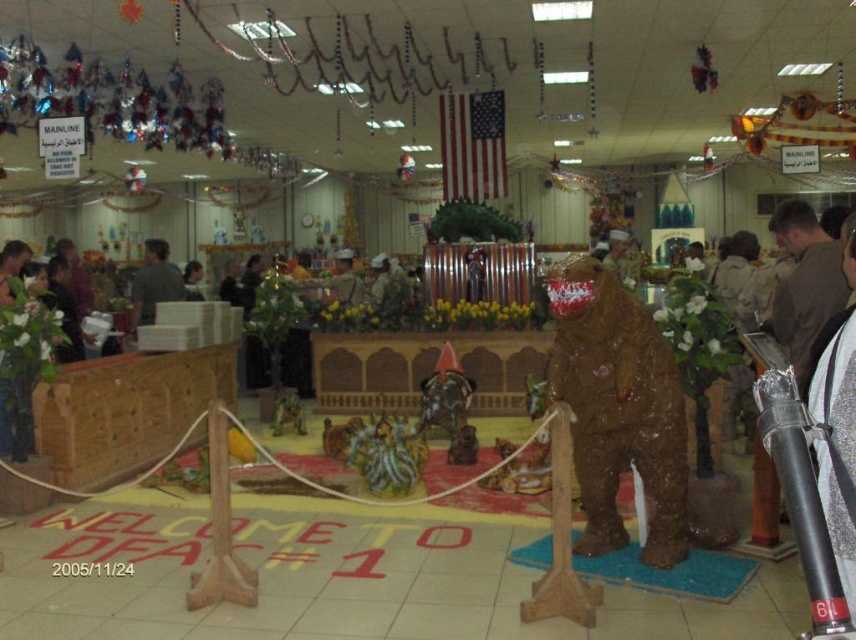
Question: Can you confirm if gray fabric shirt at center is positioned to the right of matte brown bear at center?

Choices:
 (A) yes
 (B) no

Answer: (B)

Question: Does gray fabric shirt at center appear on the left side of matte brown bear at center?

Choices:
 (A) yes
 (B) no

Answer: (A)

Question: Which point is farther to the camera?

Choices:
 (A) (176, 294)
 (B) (343, 288)

Answer: (B)

Question: Is gray fabric shirt at center closer to camera compared to matte brown bear at center?

Choices:
 (A) yes
 (B) no

Answer: (A)

Question: Which point appears closest to the camera in this image?

Choices:
 (A) (177, 273)
 (B) (325, 280)

Answer: (A)